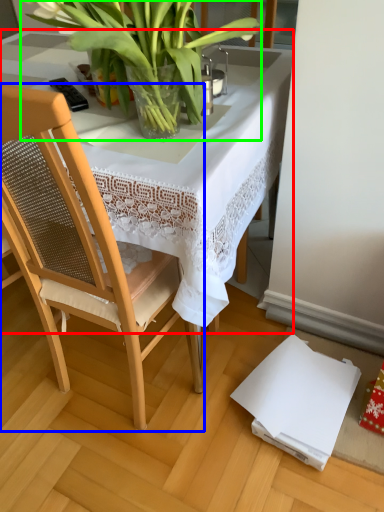
Question: Based on their relative distances, which object is farther from table (highlighted by a red box)? Choose from chair (highlighted by a blue box) and houseplant (highlighted by a green box).

Choices:
 (A) chair
 (B) houseplant

Answer: (A)